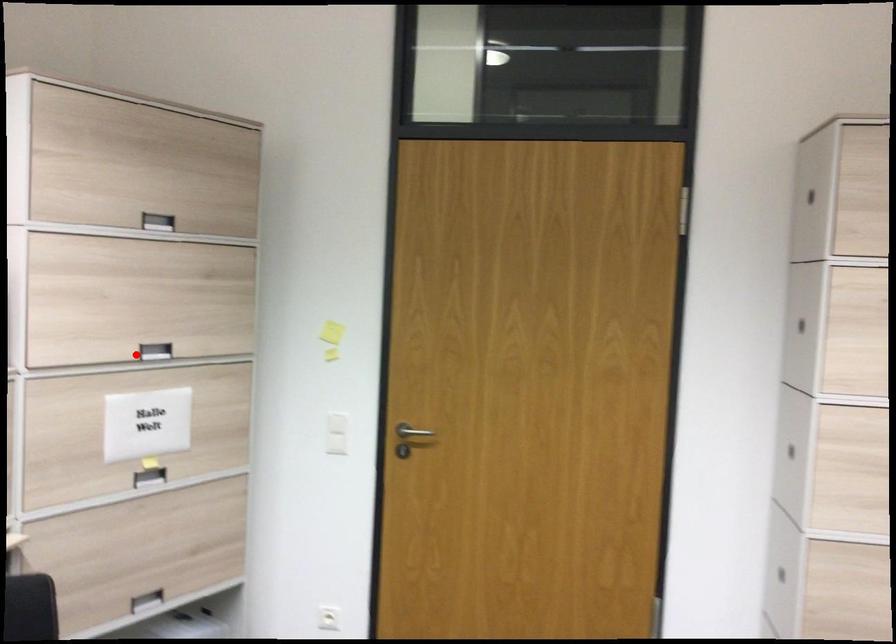
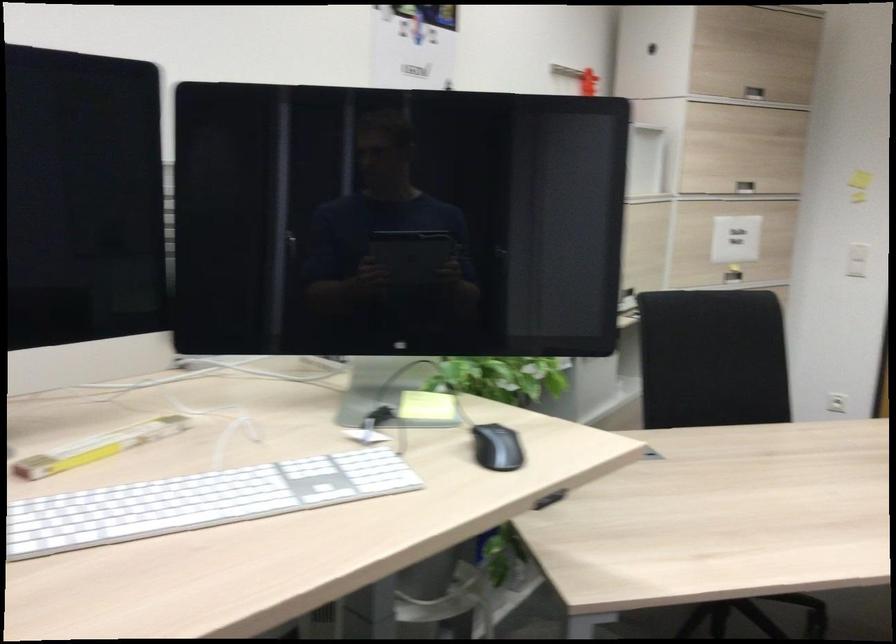
Find the pixel in the second image that matches the highlighted location in the first image.

(745, 187)